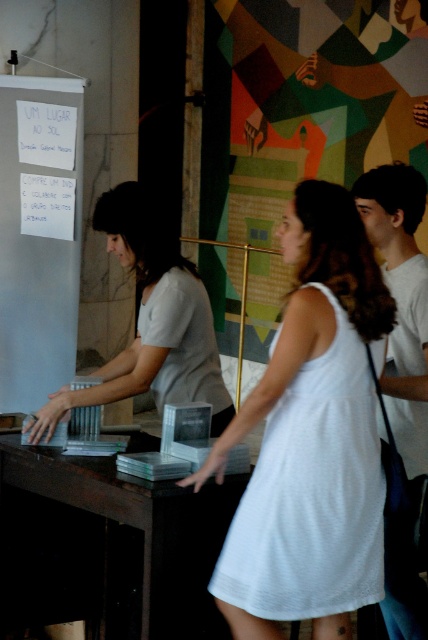
Question: Among these points, which one is nearest to the camera?

Choices:
 (A) (26, 140)
 (B) (380, 552)
 (C) (410, 579)
 (D) (211, 337)

Answer: (B)

Question: Which object is positioned closest to the white cotton dress at center?

Choices:
 (A) white matte dress at center
 (B) white cotton shirt at right

Answer: (B)

Question: Considering the real-world distances, which object is closest to the white paper at left?

Choices:
 (A) white cotton dress at center
 (B) white matte dress at center
 (C) white cotton shirt at right

Answer: (B)

Question: Is white matte dress at center smaller than white cotton shirt at right?

Choices:
 (A) yes
 (B) no

Answer: (B)

Question: Can you confirm if white matte dress at center is thinner than white cotton shirt at right?

Choices:
 (A) yes
 (B) no

Answer: (B)

Question: Is white paper at left bigger than white matte dress at center?

Choices:
 (A) yes
 (B) no

Answer: (A)